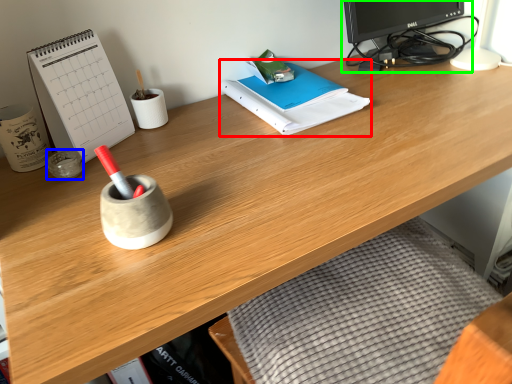
Question: Which is farther away from notebook (highlighted by a red box)? stationery (highlighted by a blue box) or desktop computer (highlighted by a green box)?

Choices:
 (A) stationery
 (B) desktop computer

Answer: (A)